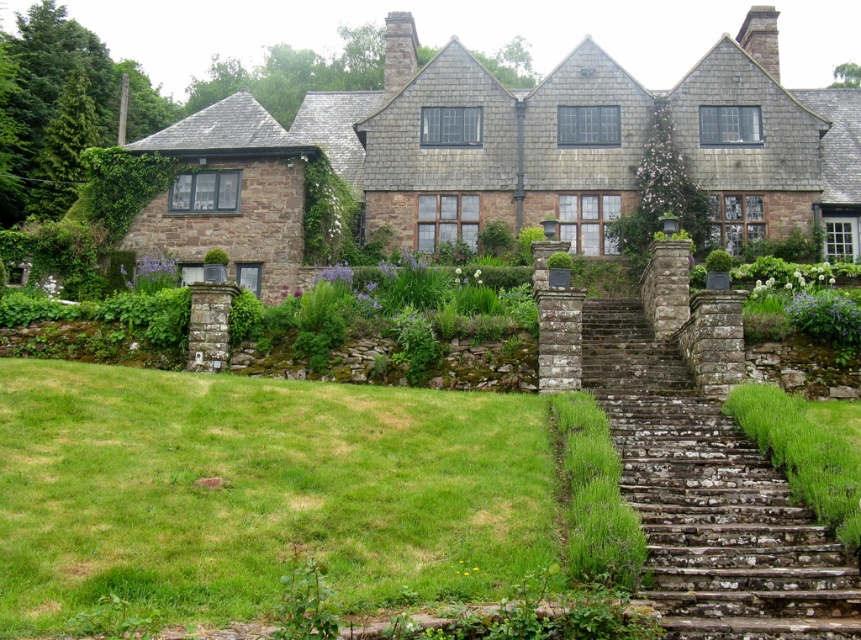
Question: Considering the relative positions of rusty stone stairs at right and green mossy stone steps at lower right in the image provided, where is rusty stone stairs at right located with respect to green mossy stone steps at lower right?

Choices:
 (A) left
 (B) right

Answer: (A)

Question: Which object is closer to the camera taking this photo?

Choices:
 (A) rusty stone stairs at right
 (B) green grass at lower left
 (C) green mossy stone steps at lower right

Answer: (B)

Question: Does green grass at lower left have a greater width compared to green mossy stone steps at lower right?

Choices:
 (A) yes
 (B) no

Answer: (A)

Question: Does green grass at lower left appear over rusty stone stairs at right?

Choices:
 (A) no
 (B) yes

Answer: (A)

Question: Which object is positioned farthest from the green grass at lower left?

Choices:
 (A) green mossy stone steps at lower right
 (B) rusty stone stairs at right

Answer: (A)

Question: Among these objects, which one is farthest from the camera?

Choices:
 (A) green mossy stone steps at lower right
 (B) rusty stone stairs at right
 (C) green grass at lower left

Answer: (A)